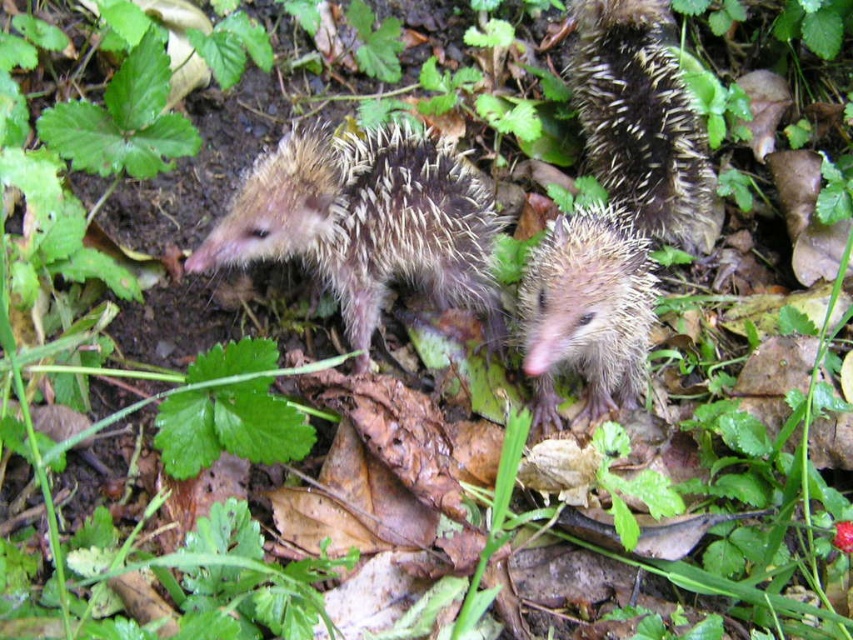
Question: From the image, what is the correct spatial relationship of spiky brown hedgehog at upper right in relation to brown spiny hedgehog at center?

Choices:
 (A) right
 (B) left

Answer: (A)

Question: Among these objects, which one is farthest from the camera?

Choices:
 (A) fuzzy brown hedgehog at center
 (B) spiky brown hedgehog at upper right

Answer: (B)

Question: Does spiky brown hedgehog at upper right appear on the left side of brown spiny hedgehog at center?

Choices:
 (A) yes
 (B) no

Answer: (B)

Question: Estimate the real-world distances between objects in this image. Which object is farther from the spiky brown hedgehog at upper right?

Choices:
 (A) brown spiny hedgehog at center
 (B) fuzzy brown hedgehog at center

Answer: (B)

Question: Which point appears farthest from the camera in this image?

Choices:
 (A) (381, 141)
 (B) (677, 182)
 (C) (566, 253)

Answer: (B)

Question: Does fuzzy brown hedgehog at center appear over brown spiny hedgehog at center?

Choices:
 (A) no
 (B) yes

Answer: (B)